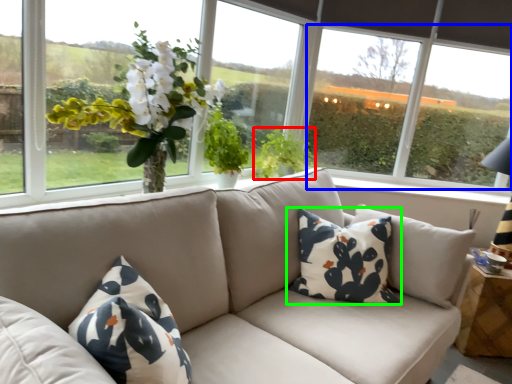
Question: Which object is the farthest from plant (highlighted by a red box)? Choose among these: window screen (highlighted by a blue box) or pillow (highlighted by a green box).

Choices:
 (A) window screen
 (B) pillow

Answer: (A)